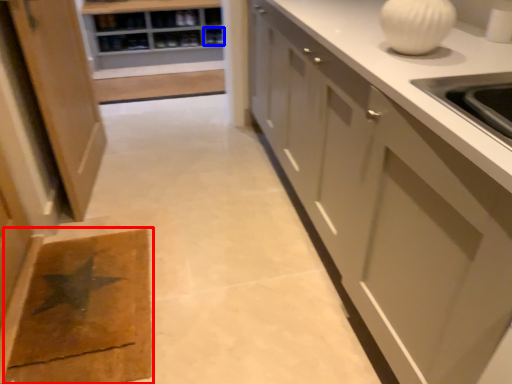
Question: Among these objects, which one is farthest to the camera, doormat (highlighted by a red box) or shelf (highlighted by a blue box)?

Choices:
 (A) doormat
 (B) shelf

Answer: (B)